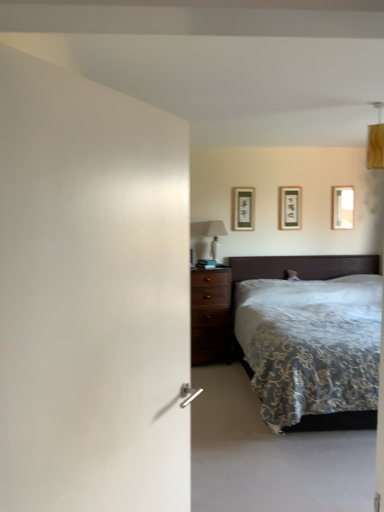
Question: Does point (365, 424) appear closer or farther from the camera than point (192, 226)?

Choices:
 (A) farther
 (B) closer

Answer: (B)

Question: In terms of size, does velvet dark brown bed at right appear bigger or smaller than white glossy table lamp at upper center?

Choices:
 (A) small
 (B) big

Answer: (B)

Question: Estimate the real-world distances between objects in this image. Which object is farther from the velvet dark brown bed at right?

Choices:
 (A) wooden picture frame at upper right, which is counted as the 3th picture frame, starting from the left
 (B) white glossy table lamp at upper center
 (C) matte black picture frame at upper center, the third picture frame in the right-to-left sequence
 (D) matte black picture frame at upper center, the 2th picture frame positioned from the right

Answer: (A)

Question: Considering the real-world distances, which object is farthest from the wooden picture frame at upper right, which is counted as the 3th picture frame, starting from the left?

Choices:
 (A) white glossy table lamp at upper center
 (B) velvet dark brown bed at right
 (C) matte black picture frame at upper center, the third picture frame in the right-to-left sequence
 (D) matte black picture frame at upper center, the second picture frame in the left-to-right sequence

Answer: (A)